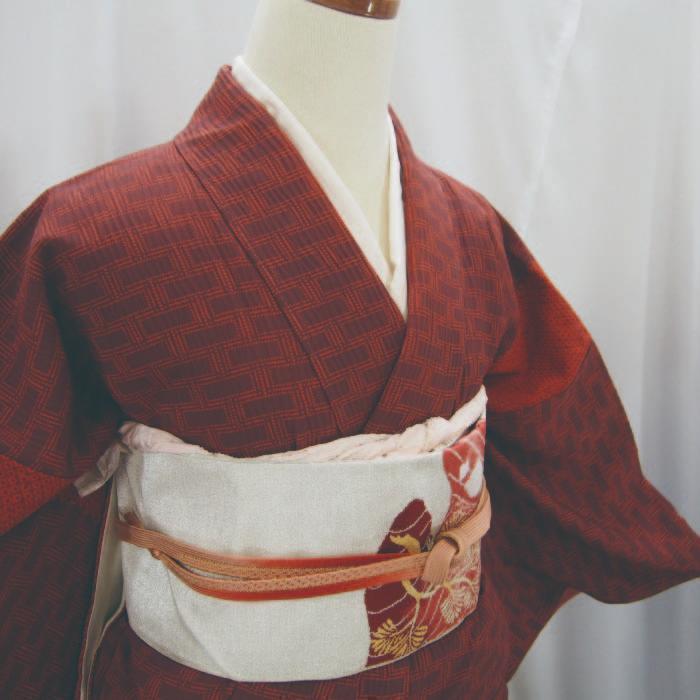
This screenshot has height=700, width=700. Find the location of `mannequin`. mannequin is located at coordinates (301, 330).